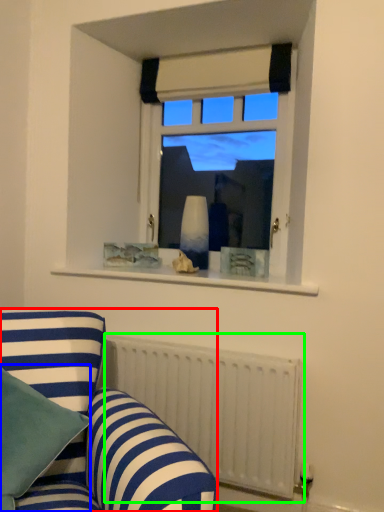
Question: Which object is positioned closest to studio couch (highlighted by a red box)? Select from pillow (highlighted by a blue box) and radiator (highlighted by a green box).

Choices:
 (A) pillow
 (B) radiator

Answer: (A)